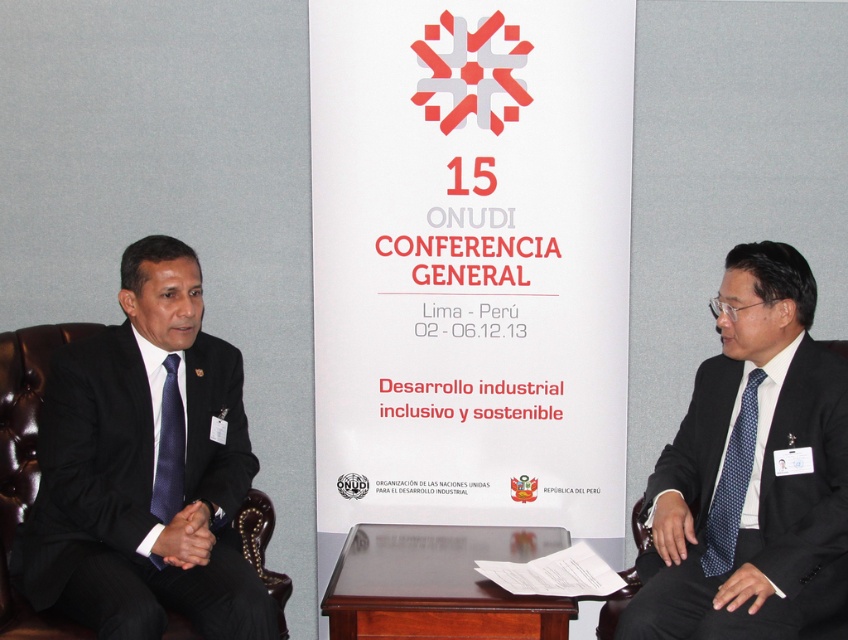
Does mahogany wood table at center have a larger size compared to blue dotted tie at left?

Yes, mahogany wood table at center is bigger than blue dotted tie at left.

Describe the element at coordinates (439, 584) in the screenshot. I see `mahogany wood table at center` at that location.

Identify the location of mahogany wood table at center. The width and height of the screenshot is (848, 640). (439, 584).

Who is positioned more to the left, mahogany wood table at center or blue dotted tie at right?

From the viewer's perspective, mahogany wood table at center appears more on the left side.

Identify the location of mahogany wood table at center. (439, 584).

You are a GUI agent. You are given a task and a screenshot of the screen. Output one action in this format:
    pyautogui.click(x=<x>, y=<y>)
    Task: Click on the mahogany wood table at center
    This screenshot has height=640, width=848.
    Given the screenshot: What is the action you would take?
    pyautogui.click(x=439, y=584)

Does black pinstripe suit at left have a lesser width compared to blue dotted tie at right?

No, black pinstripe suit at left is not thinner than blue dotted tie at right.

Is point (112, 593) positioned before point (746, 452)?

That is True.

Locate an element on the screen. This screenshot has height=640, width=848. black pinstripe suit at left is located at coordinates (146, 467).